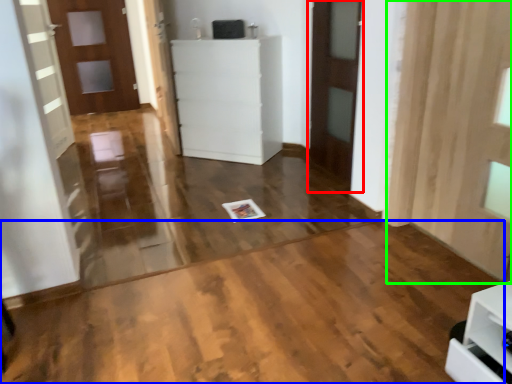
Question: Which object is the closest to the door (highlighted by a red box)? Choose among these: plywood (highlighted by a blue box) or curtain (highlighted by a green box).

Choices:
 (A) plywood
 (B) curtain

Answer: (B)